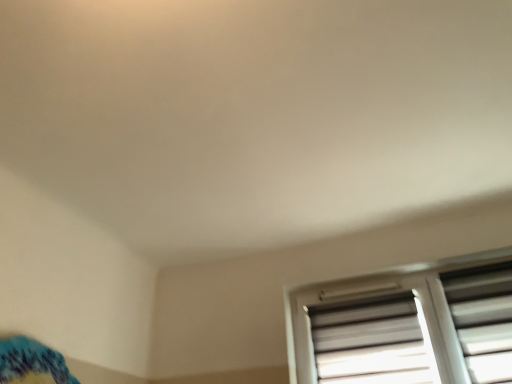
What is the approximate height of white plastic window at lower right?

The height of white plastic window at lower right is 22.52 inches.

Where is `white plastic window at lower right`? The width and height of the screenshot is (512, 384). white plastic window at lower right is located at coordinates (406, 324).

This screenshot has height=384, width=512. What do you see at coordinates (406, 324) in the screenshot?
I see `white plastic window at lower right` at bounding box center [406, 324].

Image resolution: width=512 pixels, height=384 pixels. I want to click on white plastic window at lower right, so click(406, 324).